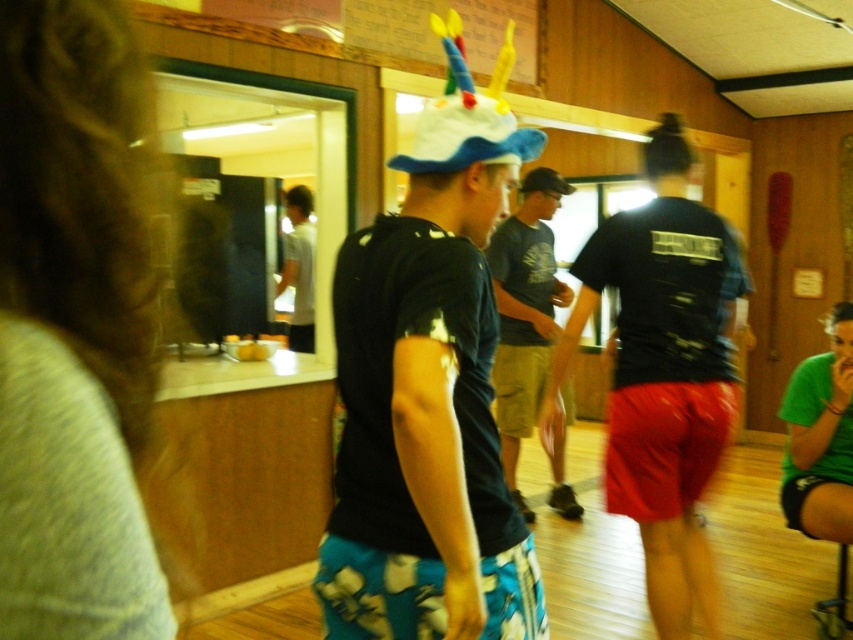
Question: Is black matte t-shirt at center bigger than dark gray t-shirt at center?

Choices:
 (A) yes
 (B) no

Answer: (A)

Question: Can you confirm if dark blue t-shirt at center is positioned to the left of dark gray t-shirt at center?

Choices:
 (A) no
 (B) yes

Answer: (B)

Question: Can you confirm if gray knit sweater at left is wider than dark blue t-shirt at center?

Choices:
 (A) no
 (B) yes

Answer: (A)

Question: Which point appears farthest from the camera in this image?

Choices:
 (A) (3, 257)
 (B) (552, 184)
 (C) (662, 349)

Answer: (B)

Question: Based on their relative distances, which object is nearer to the dark gray t-shirt at center?

Choices:
 (A) black matte t-shirt at center
 (B) white matte shirt at center

Answer: (A)

Question: Based on their relative distances, which object is nearer to the green fabric shorts at lower right?

Choices:
 (A) black fabric baseball cap at center
 (B) white matte shirt at center
 (C) dark blue t-shirt at center

Answer: (A)